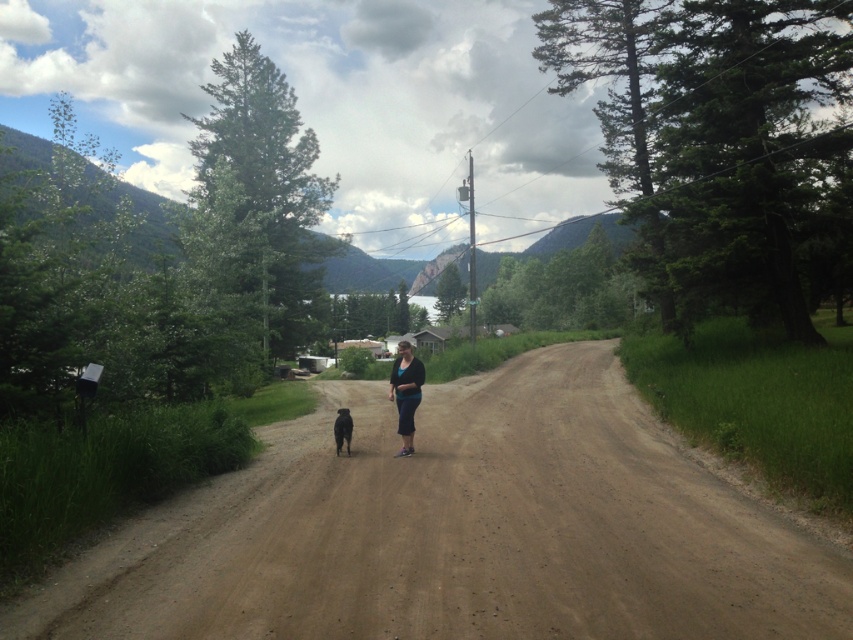
You are driving a car along the dirt road in the image and want to reach the point at coordinates (160, 573). If you continue straight, will you pass the point at (341, 406) before or after reaching your destination?

Since point (160, 573) is in front of point (341, 406), you will reach your destination at point (160, 573) before passing point (341, 406). Therefore, you will pass point (341, 406) after reaching your destination.

You are a hiker carrying a 2.5 feet wide backpack and want to walk along the brown dirt track at center while keeping the black fur dog at center on your left side. Can your backpack fit on the track without encroaching into the vegetation on the left or the edge on the right?

The brown dirt track at center might be wider than black fur dog at center. Since the dog is on your left, and the track is possibly wider, the backpack might fit, but there is uncertainty due to the description using the word might. It is safer to assume the track is just wide enough, so proceed cautiously.